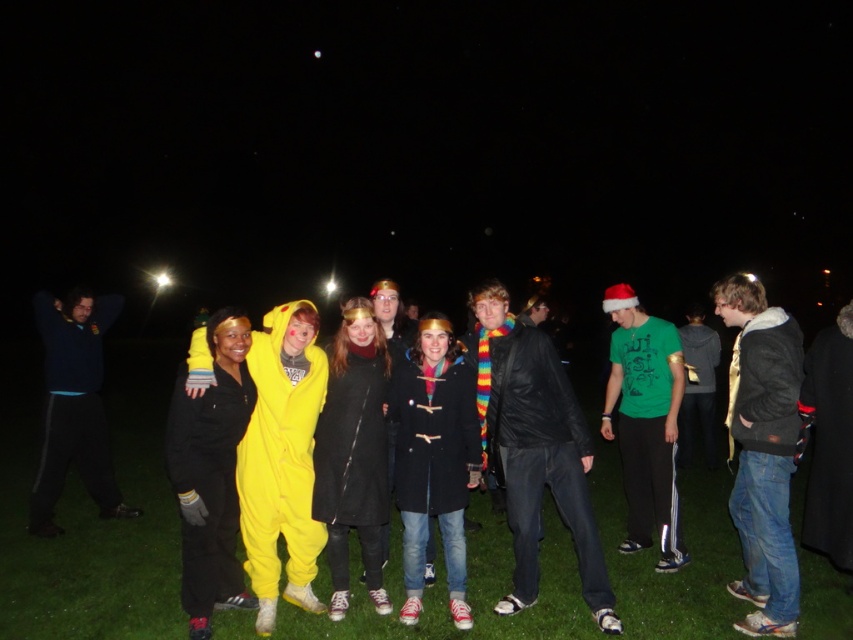
Who is positioned more to the left, green grass at center or green matte t-shirt at center-right?

From the viewer's perspective, green matte t-shirt at center-right appears more on the left side.

Does point (833, 609) lie in front of point (659, 396)?

Yes, point (833, 609) is closer to viewer.

What are the coordinates of `green grass at center` in the screenshot? It's located at (91, 563).